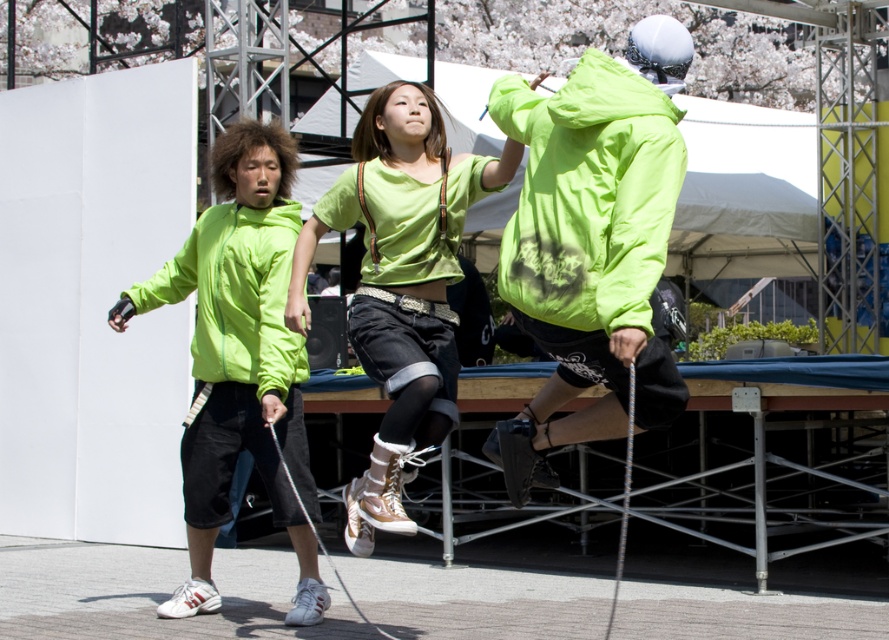
Is neon green jacket at center to the right of neon green fabric sweatshirt at center from the viewer's perspective?

Correct, you'll find neon green jacket at center to the right of neon green fabric sweatshirt at center.

Is point (595, 90) closer to camera compared to point (222, 292)?

That is True.

At what (x,y) coordinates should I click in order to perform the action: click on neon green jacket at center. Please return your answer as a coordinate pair (x, y). The width and height of the screenshot is (889, 640). Looking at the image, I should click on pyautogui.click(x=591, y=244).

Is neon green jacket at left above neon green fabric sweatshirt at center?

Incorrect, neon green jacket at left is not positioned above neon green fabric sweatshirt at center.

How far apart are neon green jacket at left and neon green fabric sweatshirt at center?

The distance of neon green jacket at left from neon green fabric sweatshirt at center is 6.67 inches.

Which is behind, point (215, 248) or point (234, 371)?

Positioned behind is point (215, 248).

At what (x,y) coordinates should I click in order to perform the action: click on neon green jacket at left. Please return your answer as a coordinate pair (x, y). The width and height of the screenshot is (889, 640). Looking at the image, I should click on (239, 358).

Based on the photo, which of these two, neon green jacket at center or matte green shirt at center, stands shorter?

neon green jacket at center

Can you confirm if neon green jacket at center is bigger than matte green shirt at center?

Actually, neon green jacket at center might be smaller than matte green shirt at center.

At what (x,y) coordinates should I click in order to perform the action: click on neon green jacket at center. Please return your answer as a coordinate pair (x, y). The width and height of the screenshot is (889, 640). Looking at the image, I should click on (591, 244).